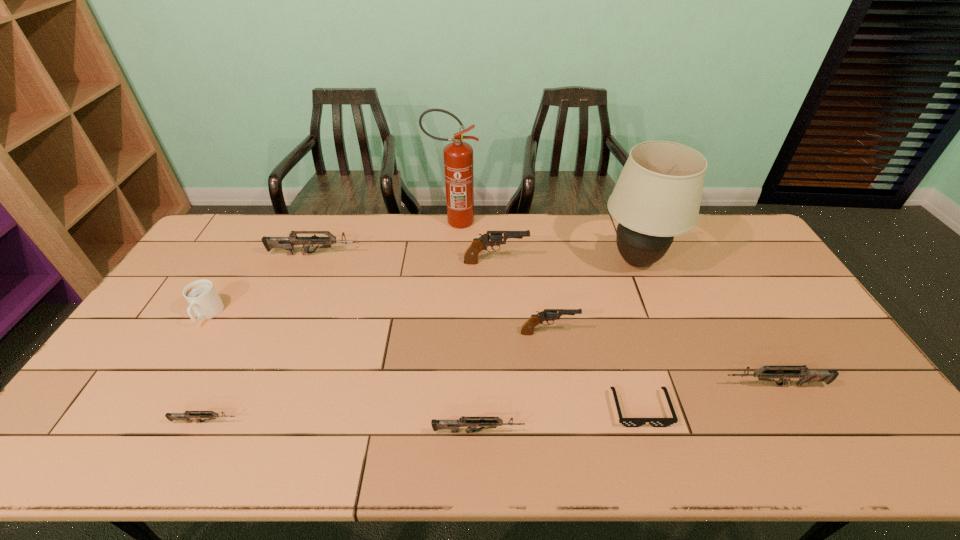
At what (x,y) coordinates should I click in order to perform the action: click on the leftmost object. Please return your answer as a coordinate pair (x, y). Looking at the image, I should click on (203, 299).

This screenshot has height=540, width=960. Identify the location of the rightmost gun. (805, 376).

Where is `the third smallest grey gun`? the third smallest grey gun is located at coordinates (805, 376).

Identify the location of the eighth tallest object. (483, 422).

The image size is (960, 540). In order to click on the third biggest grey gun in this screenshot , I will do `click(483, 422)`.

At what (x,y) coordinates should I click in order to perform the action: click on the second nearest gun. Please return your answer as a coordinate pair (x, y). This screenshot has height=540, width=960. Looking at the image, I should click on (209, 415).

In order to click on the second nearest grey gun in this screenshot , I will do `click(209, 415)`.

Where is `sunglasses`? The height and width of the screenshot is (540, 960). sunglasses is located at coordinates (628, 422).

Where is `black sunglasses`? black sunglasses is located at coordinates (628, 422).

Identify the location of blank space located from the nozzle of the farthest object. (542, 221).